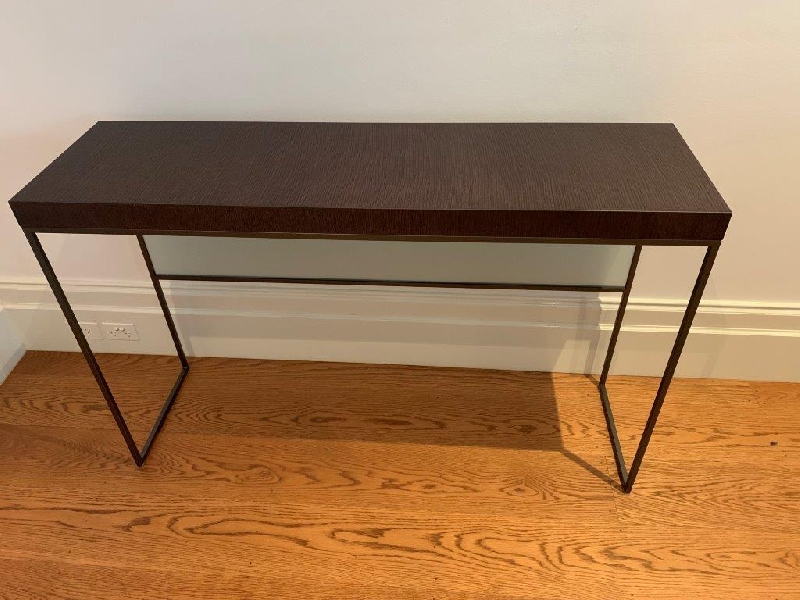
Where is `brown wooden table`? The width and height of the screenshot is (800, 600). brown wooden table is located at coordinates 274,181.